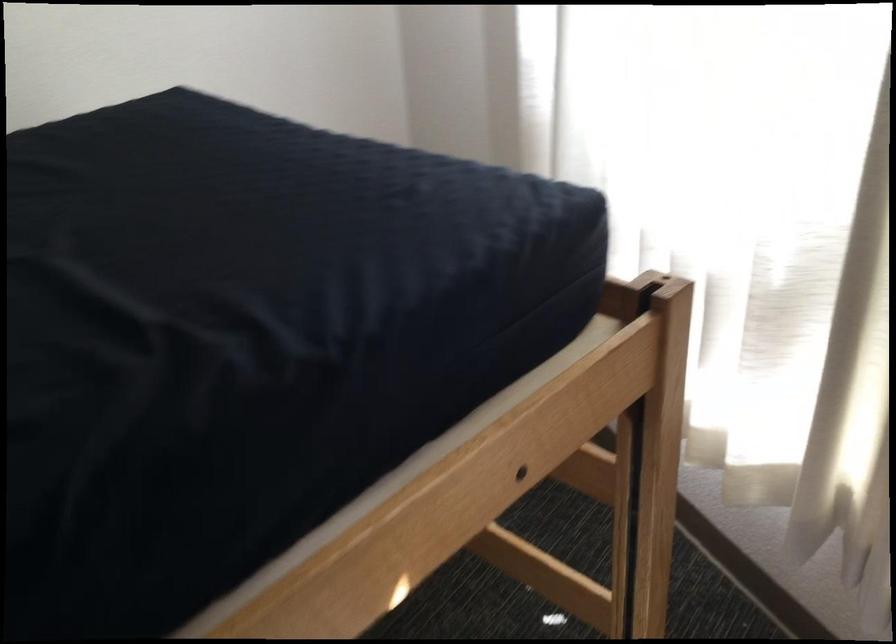
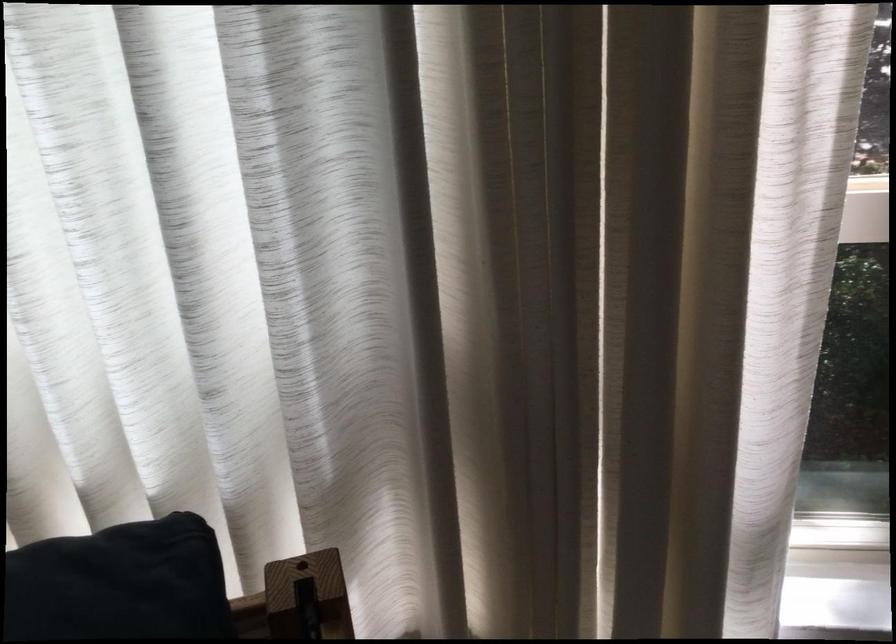
Question: The images are taken continuously from a first-person perspective. In which direction is your viewpoint rotating?

Choices:
 (A) Left
 (B) Right
 (C) Up
 (D) Down

Answer: (B)